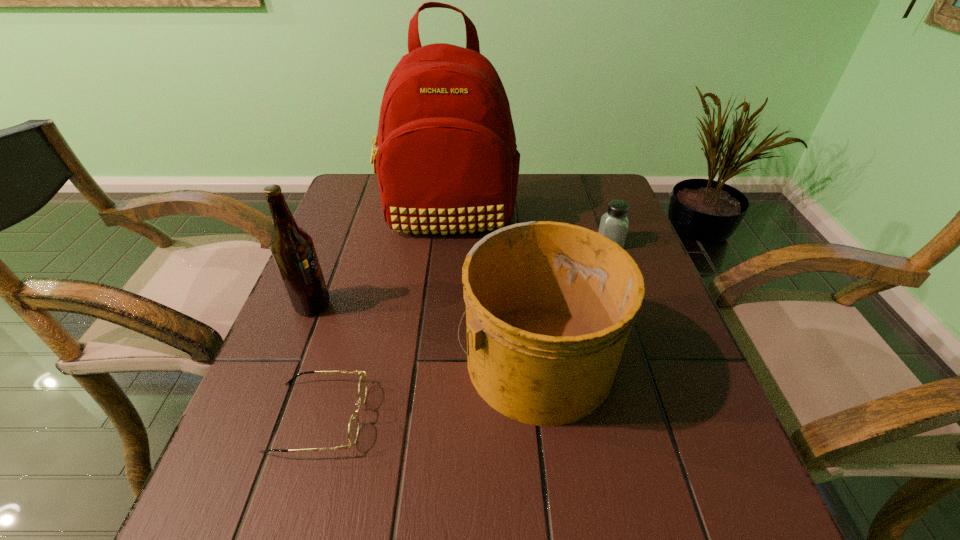
The height and width of the screenshot is (540, 960). In order to click on vacant point located on the lenses of the spectacles in this screenshot , I will do `click(480, 417)`.

You are a GUI agent. You are given a task and a screenshot of the screen. Output one action in this format:
    pyautogui.click(x=<x>, y=<y>)
    Task: Click on the object that is positioned at the far edge
    The image size is (960, 540).
    Given the screenshot: What is the action you would take?
    pyautogui.click(x=446, y=159)

Identify the location of backpack that is at the left edge. Image resolution: width=960 pixels, height=540 pixels. (446, 159).

The image size is (960, 540). Find the location of `beer bottle that is at the left edge`. beer bottle that is at the left edge is located at coordinates (292, 247).

The width and height of the screenshot is (960, 540). In order to click on spectacles at the left edge in this screenshot , I will do `click(353, 429)`.

Where is `bucket that is at the right edge`? bucket that is at the right edge is located at coordinates (549, 305).

In order to click on saltshaker positioned at the right edge in this screenshot , I will do `click(614, 223)`.

You are a GUI agent. You are given a task and a screenshot of the screen. Output one action in this format:
    pyautogui.click(x=<x>, y=<y>)
    Task: Click on the object positioned at the far left corner
    
    Given the screenshot: What is the action you would take?
    pyautogui.click(x=446, y=159)

Image resolution: width=960 pixels, height=540 pixels. In the image, there is a desktop. Find the location of `vacant space at the left edge`. vacant space at the left edge is located at coordinates (326, 383).

What are the coordinates of `vacant space at the right edge` in the screenshot? It's located at (729, 440).